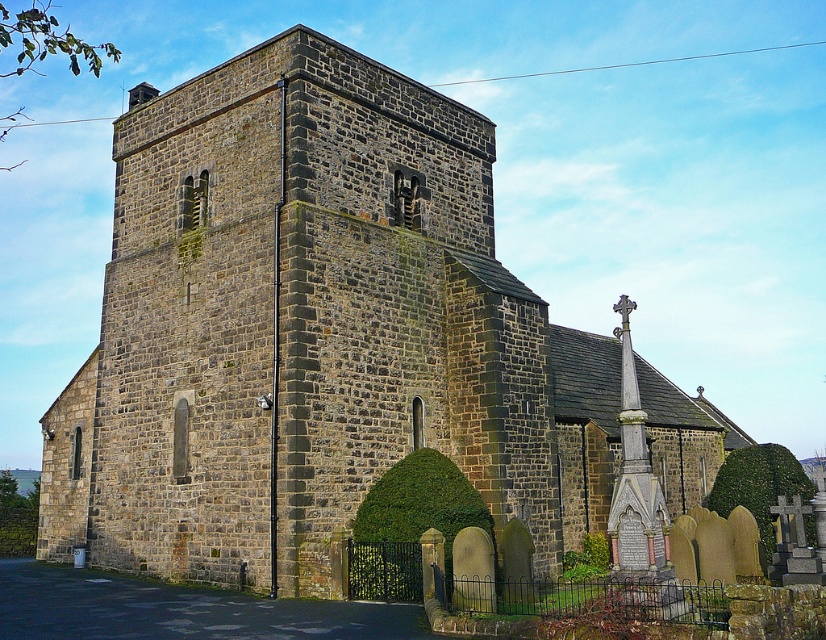
You are standing at the entrance of the historic stone church and want to walk towards the green leafy hedge at lower center. Based on the coordinates provided, in which direction should you move relative to your current position?

The green leafy hedge at lower center is located at coordinates point (409, 524). Since the entrance is mentioned as being near the cross, you should move towards the lower center direction to reach the hedge.